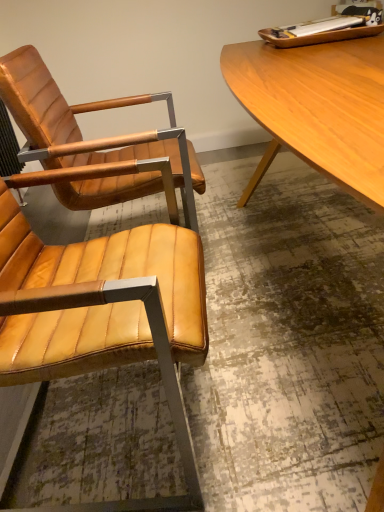
Question: Is light brown wood desk at upper right further to the viewer compared to matte leather chair at left, the 2th chair in the front-to-back sequence?

Choices:
 (A) yes
 (B) no

Answer: (B)

Question: From a real-world perspective, is light brown wood desk at upper right beneath matte leather chair at left, the 2th chair in the front-to-back sequence?

Choices:
 (A) no
 (B) yes

Answer: (B)

Question: Does light brown wood desk at upper right appear on the right side of matte leather chair at left, the 1th chair positioned from the back?

Choices:
 (A) no
 (B) yes

Answer: (B)

Question: Is light brown wood desk at upper right at the left side of matte leather chair at left, the 1th chair positioned from the back?

Choices:
 (A) no
 (B) yes

Answer: (A)

Question: Does light brown wood desk at upper right have a greater width compared to matte leather chair at left, the 2th chair in the front-to-back sequence?

Choices:
 (A) no
 (B) yes

Answer: (B)

Question: Is light brown wood desk at upper right touching matte leather chair at left, the 2th chair in the front-to-back sequence?

Choices:
 (A) yes
 (B) no

Answer: (B)

Question: Can you confirm if light brown wood desk at upper right is smaller than matte leather chair at left, placed as the second chair when sorted from back to front?

Choices:
 (A) yes
 (B) no

Answer: (B)

Question: Is light brown wood desk at upper right not inside matte leather chair at left, positioned as the first chair in front-to-back order?

Choices:
 (A) no
 (B) yes

Answer: (B)

Question: Is light brown wood desk at upper right thinner than matte leather chair at left, placed as the second chair when sorted from back to front?

Choices:
 (A) no
 (B) yes

Answer: (A)

Question: From the image's perspective, would you say light brown wood desk at upper right is shown under matte leather chair at left, positioned as the first chair in front-to-back order?

Choices:
 (A) yes
 (B) no

Answer: (B)

Question: Is light brown wood desk at upper right shorter than matte leather chair at left, positioned as the first chair in front-to-back order?

Choices:
 (A) no
 (B) yes

Answer: (B)

Question: Is light brown wood desk at upper right at the right side of matte leather chair at left, placed as the second chair when sorted from back to front?

Choices:
 (A) yes
 (B) no

Answer: (A)

Question: Considering the relative sizes of matte leather chair at left, the 2th chair in the front-to-back sequence, and matte leather chair at left, placed as the second chair when sorted from back to front, in the image provided, is matte leather chair at left, the 2th chair in the front-to-back sequence, taller than matte leather chair at left, placed as the second chair when sorted from back to front,?

Choices:
 (A) yes
 (B) no

Answer: (A)